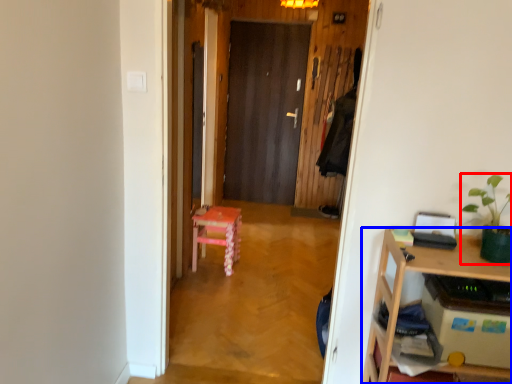
Question: Which of the following is the farthest to the observer, houseplant (highlighted by a red box) or desk (highlighted by a blue box)?

Choices:
 (A) houseplant
 (B) desk

Answer: (A)